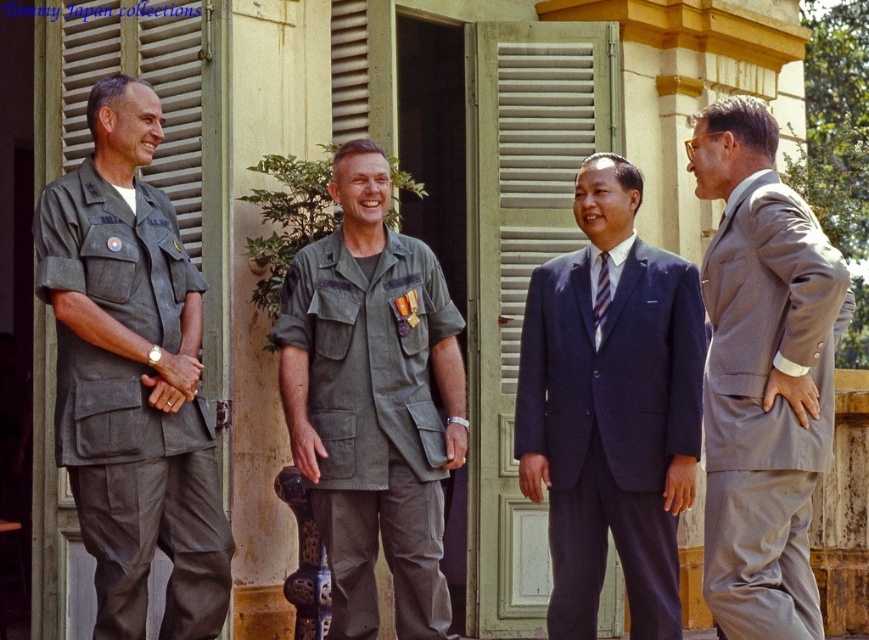
Question: Does matte green uniform at left have a lesser width compared to navy blue suit at center?

Choices:
 (A) no
 (B) yes

Answer: (B)

Question: Does navy blue suit at center have a greater width compared to gray wool suit at right?

Choices:
 (A) yes
 (B) no

Answer: (A)

Question: Which object is farther from the camera taking this photo?

Choices:
 (A) striped silk tie at center
 (B) gray wool suit at right

Answer: (A)

Question: Observing the image, what is the correct spatial positioning of matte green uniform at left in reference to matte green uniform at center?

Choices:
 (A) right
 (B) left

Answer: (B)

Question: Which of the following is the farthest from the observer?

Choices:
 (A) (599, 253)
 (B) (596, 550)
 (C) (312, 378)
 (D) (780, 595)

Answer: (A)

Question: Which point is closer to the camera taking this photo?

Choices:
 (A) (346, 561)
 (B) (615, 550)

Answer: (A)